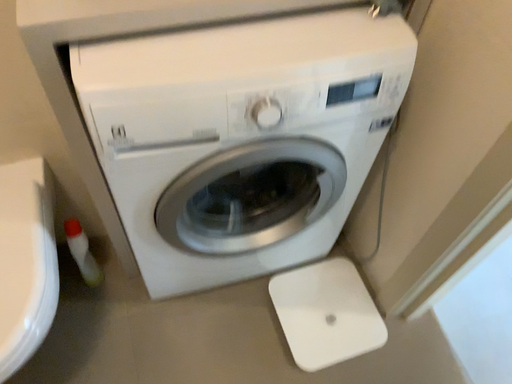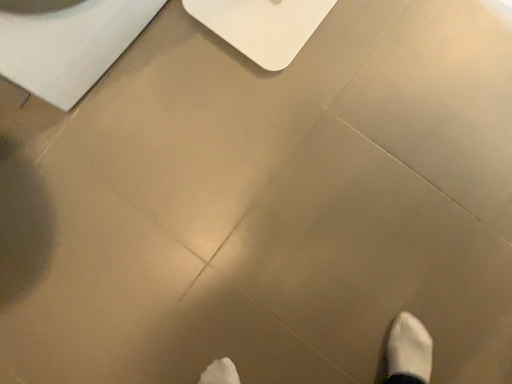
Question: How did the camera likely rotate when shooting the video?

Choices:
 (A) rotated upward
 (B) rotated downward

Answer: (B)